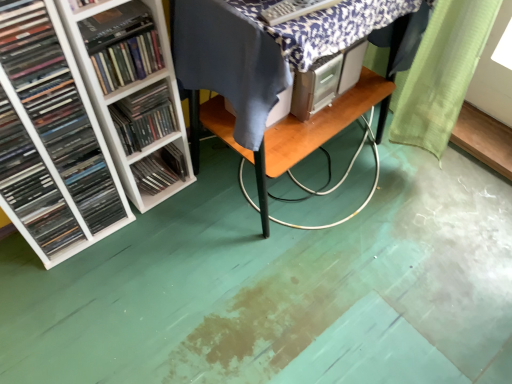
Find the location of a particular element. The image size is (512, 384). free space in front of wooden table at center is located at coordinates (331, 288).